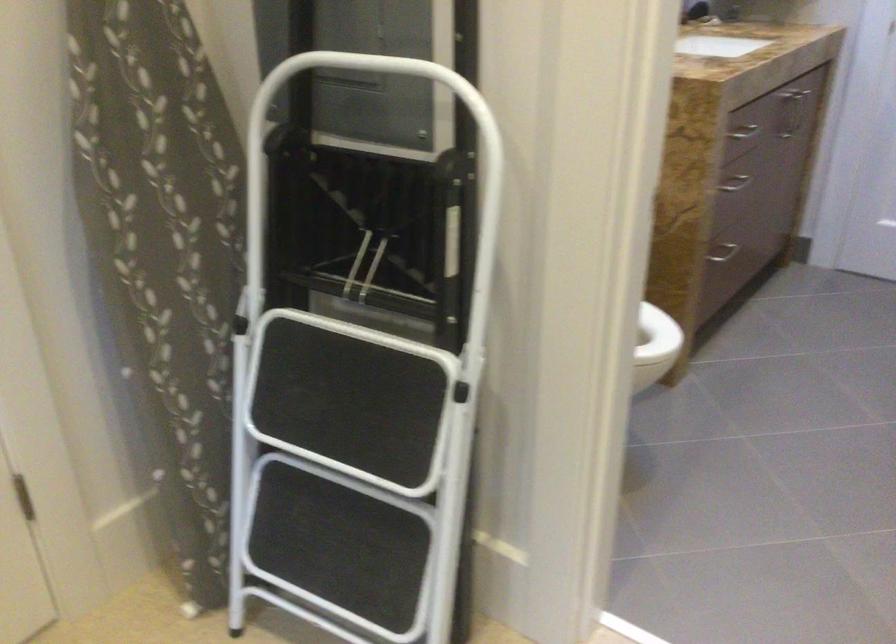
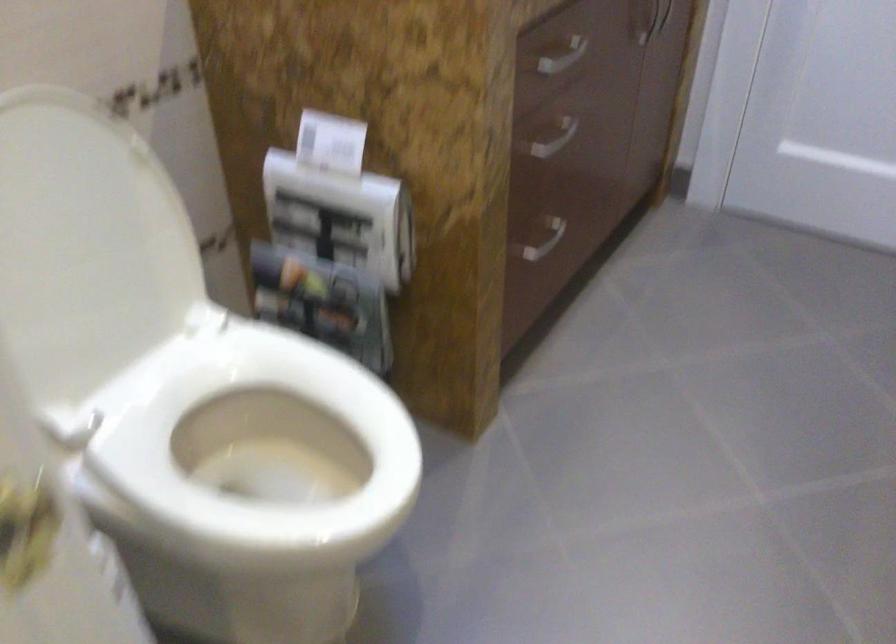
From the picture: What movement of the cameraman would produce the second image?

The movement direction of the cameraman is right, forward.